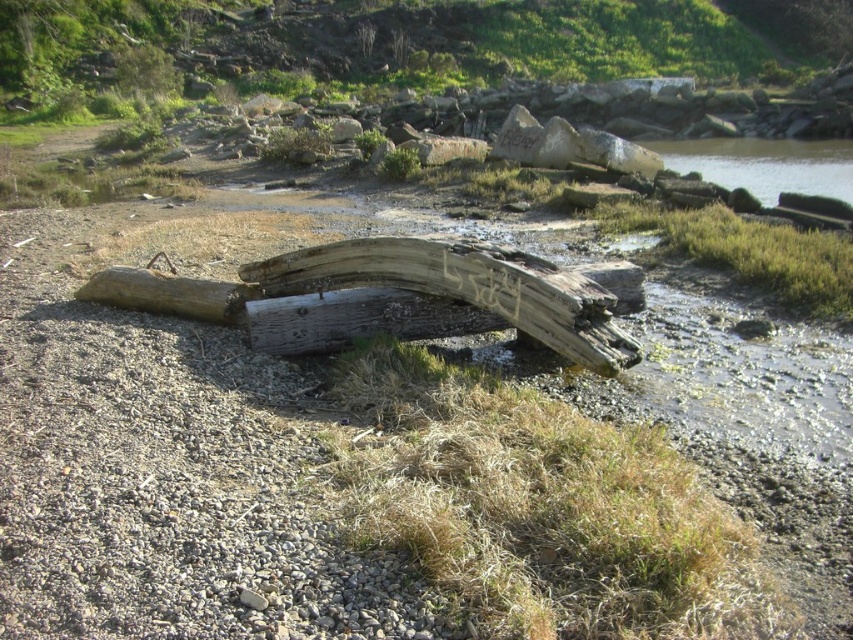
Is weathered wood log at center below clear water at right?

Correct, weathered wood log at center is located below clear water at right.

Which is behind, point (527, 296) or point (663, 154)?

Positioned behind is point (663, 154).

I want to click on weathered wood log at center, so click(x=467, y=289).